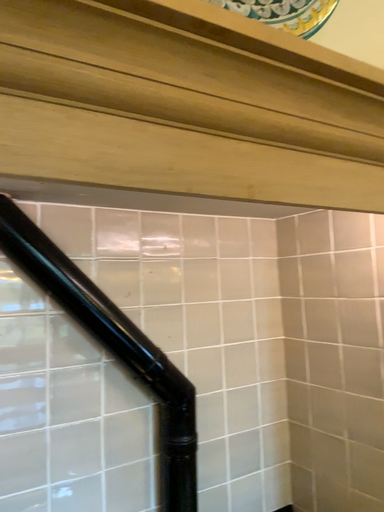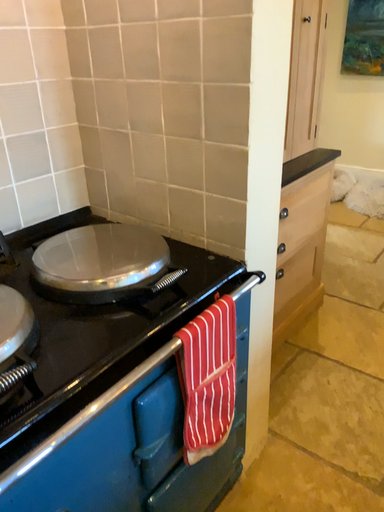
Question: How did the camera likely rotate when shooting the video?

Choices:
 (A) rotated right
 (B) rotated left

Answer: (A)